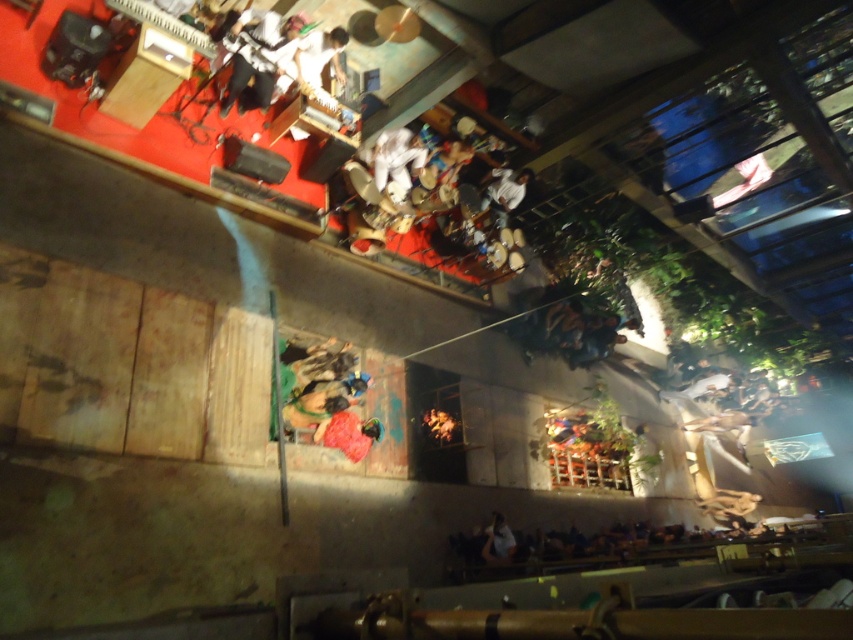
You are a photographer at the concert. You want to take a photo of the white matte shirt at upper center and the smooth brown leather jacket at lower right. Which object is located higher in the image?

The white matte shirt at upper center is positioned over smooth brown leather jacket at lower right, so it is higher in the image.

You are a photographer at this event and want to capture both the white matte shirt at upper center and the smooth brown leather jacket at lower right in a single shot. Considering their sizes, which one might appear more prominent in the photo?

The smooth brown leather jacket at lower right would appear more prominent in the photo since it is larger than the white matte shirt at upper center.